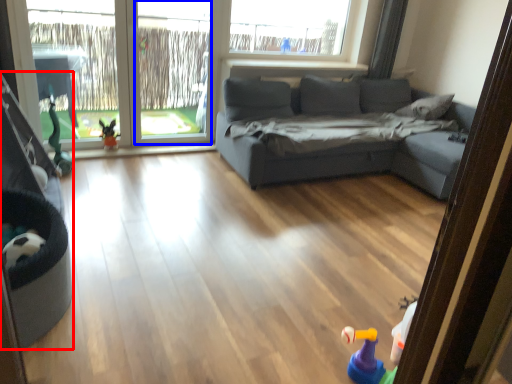
Question: Which point is further to the camera, baby carriage (highlighted by a red box) or window screen (highlighted by a blue box)?

Choices:
 (A) baby carriage
 (B) window screen

Answer: (B)